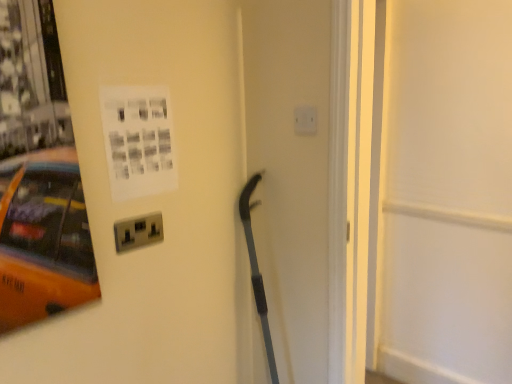
Question: Is white plastic electric outlet at upper center, which is the second electric outlet from bottom to top, taller or shorter than white paper at upper left?

Choices:
 (A) tall
 (B) short

Answer: (B)

Question: Is point (309, 132) positioned closer to the camera than point (103, 127)?

Choices:
 (A) closer
 (B) farther

Answer: (B)

Question: Estimate the real-world distances between objects in this image. Which object is farther from the white plastic electric outlet at center-left, placed as the 1th electric outlet when sorted from front to back?

Choices:
 (A) white plastic electric outlet at upper center, the second electric outlet in the left-to-right sequence
 (B) white paper at upper left
 (C) white matte door at center

Answer: (C)

Question: Which of these objects is positioned closest to the white matte door at center?

Choices:
 (A) white paper at upper left
 (B) white plastic electric outlet at upper center, the 1th electric outlet when ordered from back to front
 (C) white plastic electric outlet at center-left, the second electric outlet when ordered from back to front

Answer: (B)